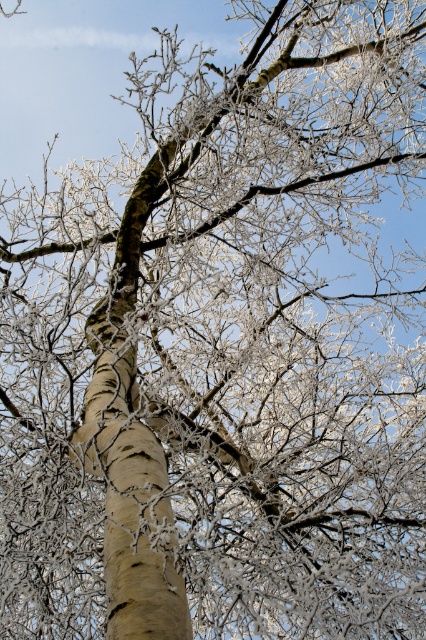
Question: Is frosted bark branch at center to the left of smooth beige bark at center from the viewer's perspective?

Choices:
 (A) no
 (B) yes

Answer: (B)

Question: Is frosted bark branch at center bigger than smooth beige bark at center?

Choices:
 (A) no
 (B) yes

Answer: (B)

Question: Does frosted bark branch at center appear over smooth beige bark at center?

Choices:
 (A) yes
 (B) no

Answer: (A)

Question: Which point is farther from the camera taking this photo?

Choices:
 (A) (80, 44)
 (B) (106, 554)

Answer: (A)

Question: Among these objects, which one is farthest from the camera?

Choices:
 (A) smooth beige bark at center
 (B) frosted bark branch at center

Answer: (B)